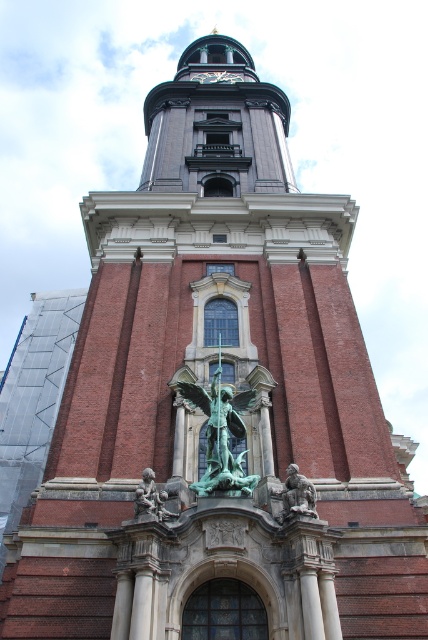
Who is lower down, green patina statue at center or bronze statue at center?

bronze statue at center is lower down.

Does green patina statue at center have a smaller size compared to bronze statue at center?

No.

What are the coordinates of `green patina statue at center` in the screenshot? It's located at click(x=222, y=436).

Which is in front, point (183, 388) or point (148, 483)?

Point (148, 483) is in front.

Which is below, green patina statue at center or green patina statue at lower center?

green patina statue at lower center

Locate an element on the screen. The image size is (428, 640). green patina statue at center is located at coordinates (222, 436).

Can you confirm if bronze statue at center is positioned to the right of green patina statue at lower center?

Indeed, bronze statue at center is positioned on the right side of green patina statue at lower center.

Who is more forward, (288, 496) or (154, 488)?

Positioned in front is point (288, 496).

Where is `bronze statue at center`? This screenshot has height=640, width=428. bronze statue at center is located at coordinates (296, 496).